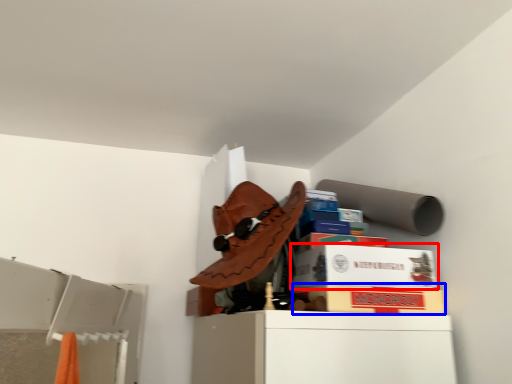
Question: Which object is closer to the camera taking this photo, cardboard box (highlighted by a red box) or cardboard box (highlighted by a blue box)?

Choices:
 (A) cardboard box
 (B) cardboard box

Answer: (B)